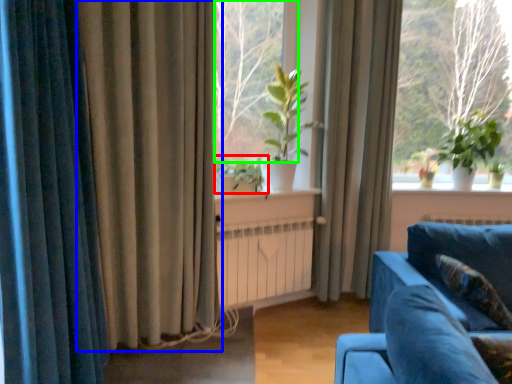
Question: Which object is positioned farthest from plant (highlighted by a red box)? Select from curtain (highlighted by a blue box) and window screen (highlighted by a green box).

Choices:
 (A) curtain
 (B) window screen

Answer: (B)